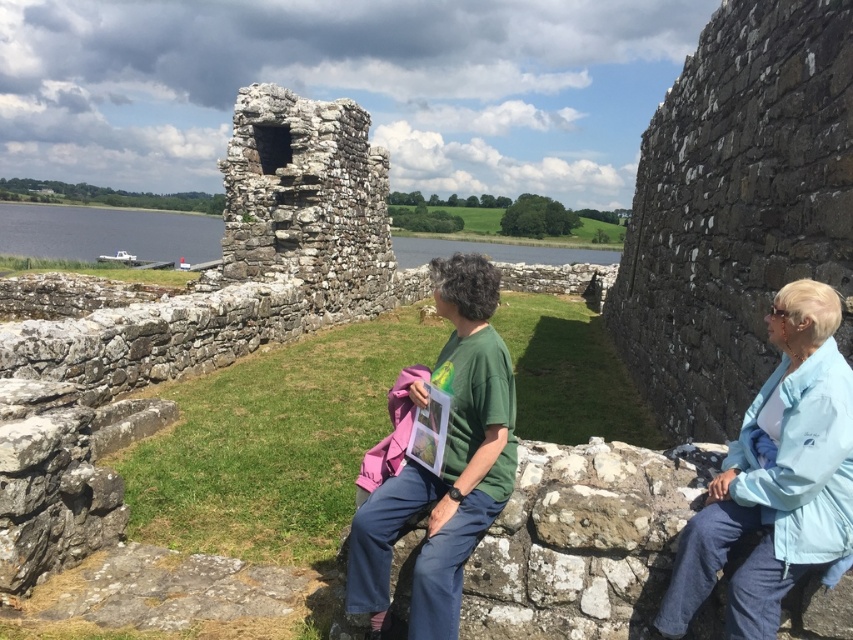
You are a photographer wanting to capture both the light blue fabric at right and the green matte shirt at center in your shot. Since you want both subjects to be clearly visible, which one should you focus on first to ensure the other remains in focus?

You should focus on the light blue fabric at right first because it is in front of the green matte shirt at center. By focusing on the closer subject, the background subject will still be in focus due to the depth of field.

You are a photographer trying to capture the light blue fabric at right and the clear water at lower left in the same frame. Based on their positions, which object should you adjust your camera to focus on first to ensure both are in the shot?

The light blue fabric at right is to the right of clear water at lower left, so you should focus on the clear water at lower left first to ensure both are in the frame.